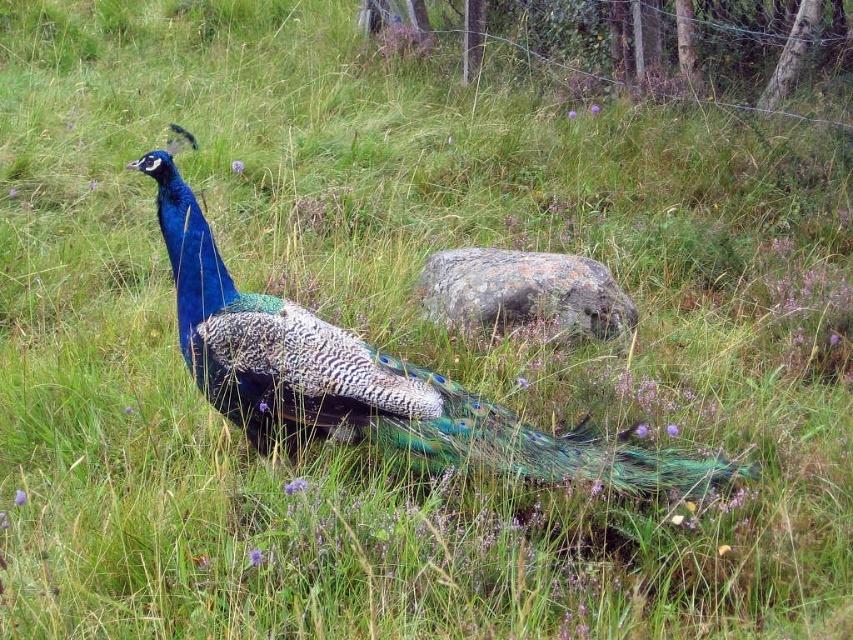
How much distance is there between shiny blue peacock at center and gray rough rock at center?

shiny blue peacock at center and gray rough rock at center are 39.21 inches apart from each other.

Between shiny blue peacock at center and gray rough rock at center, which one appears on the right side from the viewer's perspective?

gray rough rock at center is more to the right.

Where is `shiny blue peacock at center`? The height and width of the screenshot is (640, 853). shiny blue peacock at center is located at coordinates (364, 378).